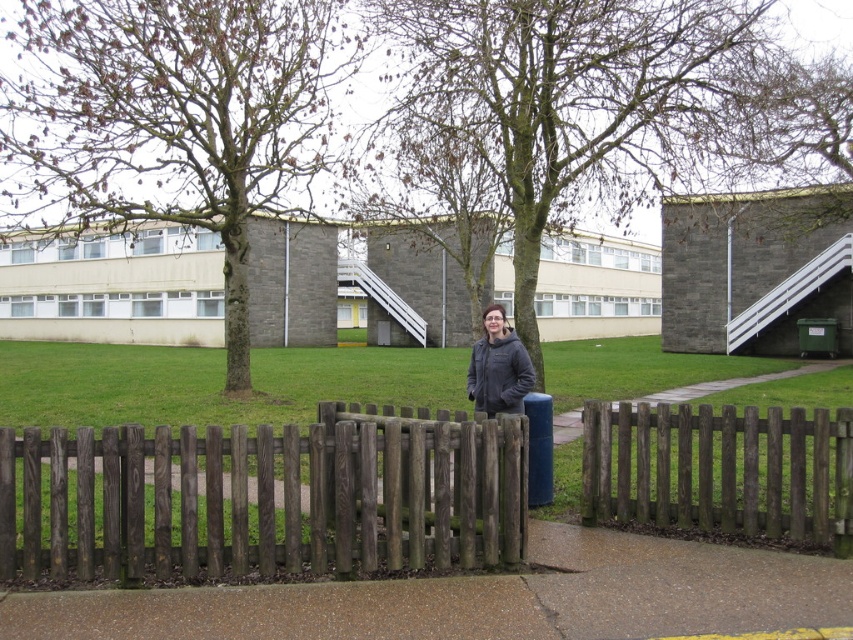
You are a delivery person trying to reach the building in the background. You see the dark brown wooden fence at center and the smooth concrete pavement at center. Which object is closer to you as you approach the building?

The dark brown wooden fence at center is closer to you than the smooth concrete pavement at center, so you would encounter the dark brown wooden fence at center first when approaching the building.

You are a delivery person trying to deliver a package to the person standing behind the wooden fence. The smooth concrete pavement at center is where you need to place the package. Since the dark gray jacket at center is behind the pavement, will the person be able to reach the package easily?

The smooth concrete pavement at center is in front of the dark gray jacket at center, meaning the pavement is closer to you and farther from the person. The person might have difficulty reaching the package placed on the pavement since it is positioned in front of them.

You are a delivery person trying to locate the entrance to the building in the background. You see the brown wooden fence at center and the dark gray jacket at center. Which object is closer to the entrance of the building?

The brown wooden fence at center is closer to the entrance of the building because it is positioned to the right of the dark gray jacket at center, suggesting it is near the entrance area.